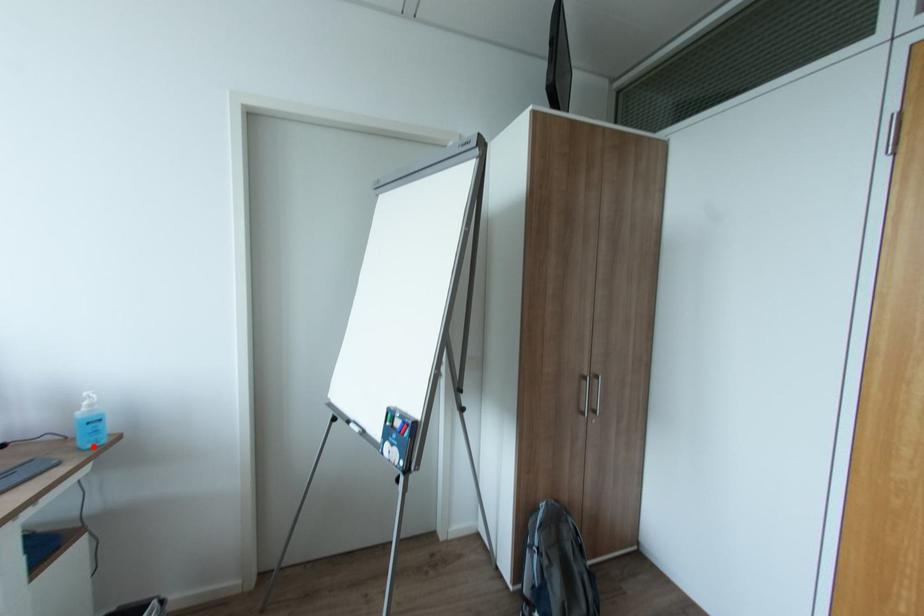
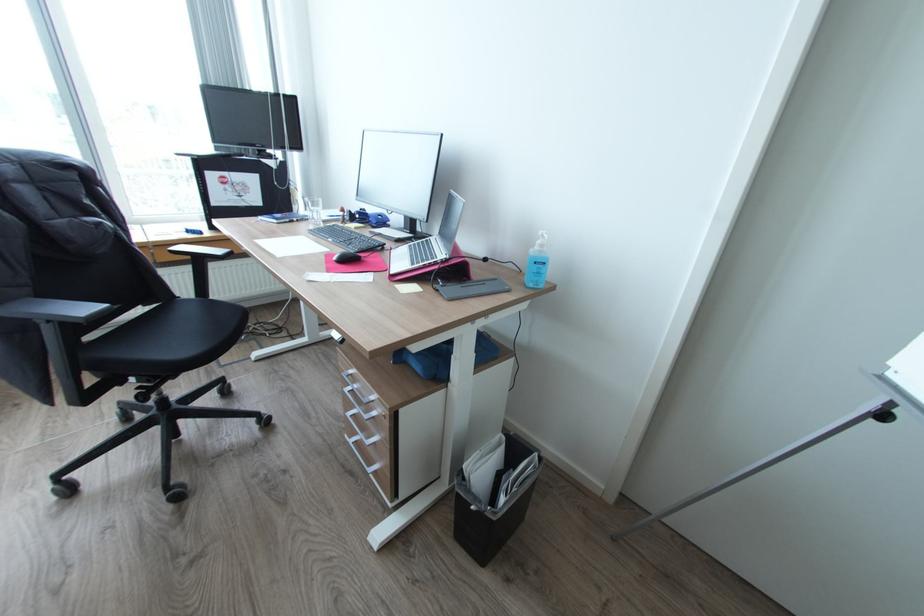
Question: I am providing you with two images of the same scene from different viewpoints. A red point is marked on the first image. Is the red point's position out of view in image 2?

Choices:
 (A) Yes
 (B) No

Answer: (B)